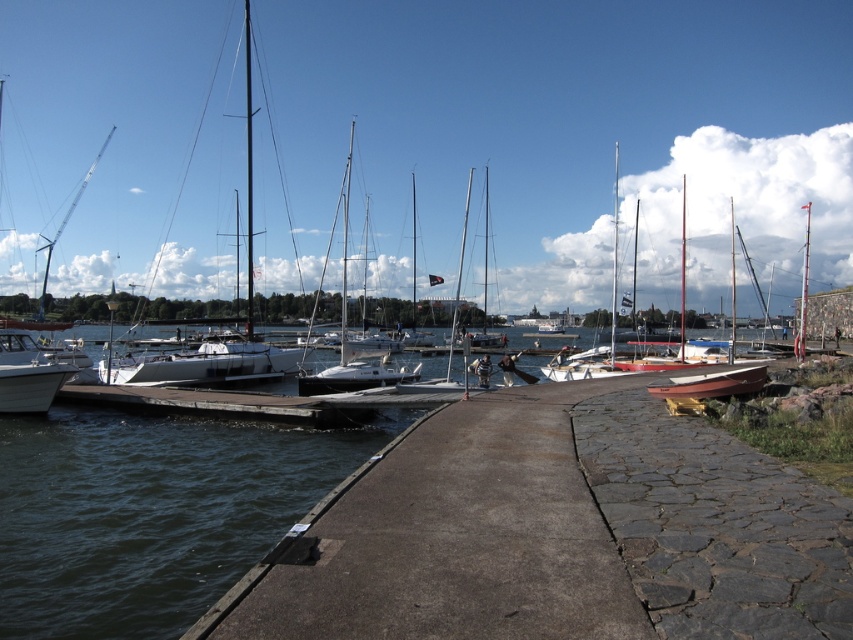
Based on the photo, you are a visitor standing on the walkway and want to board a boat. Which object between the concrete dock at center and the dark blue water at lower left should you approach to reach the boat?

You should approach the concrete dock at center because it is a dock designed for boarding boats, while the dark blue water at lower left is just the water surface where boats float. The concrete dock at center is smaller in size compared to the dark blue water at lower left, but size does not affect its functionality for boarding.

You are a photographer planning to capture the entire scene of the concrete dock at center and the white matte sailboat at left in one frame. Based on their sizes in the image, which object would you need to position closer to the camera to ensure both fit within the frame?

Since the concrete dock at center occupies less space than the white matte sailboat at left, you should position the white matte sailboat at left closer to the camera to ensure both fit within the frame. This adjustment would make the larger boat appear smaller, balancing their sizes in the photograph.

You are standing on the walkway and want to know which object is taller between the concrete dock at center and the white matte sailboat at left. Which one is taller?

The white matte sailboat at left is taller than the concrete dock at center.